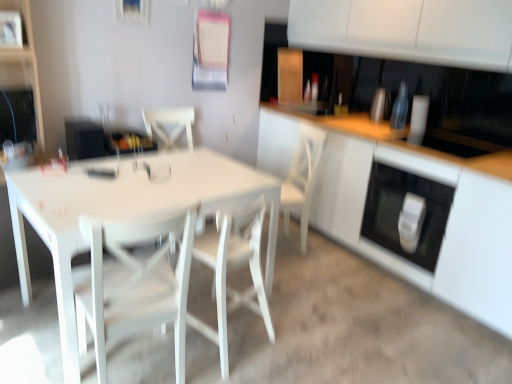
The width and height of the screenshot is (512, 384). I want to click on spots to the right of white glossy table at center, so click(320, 299).